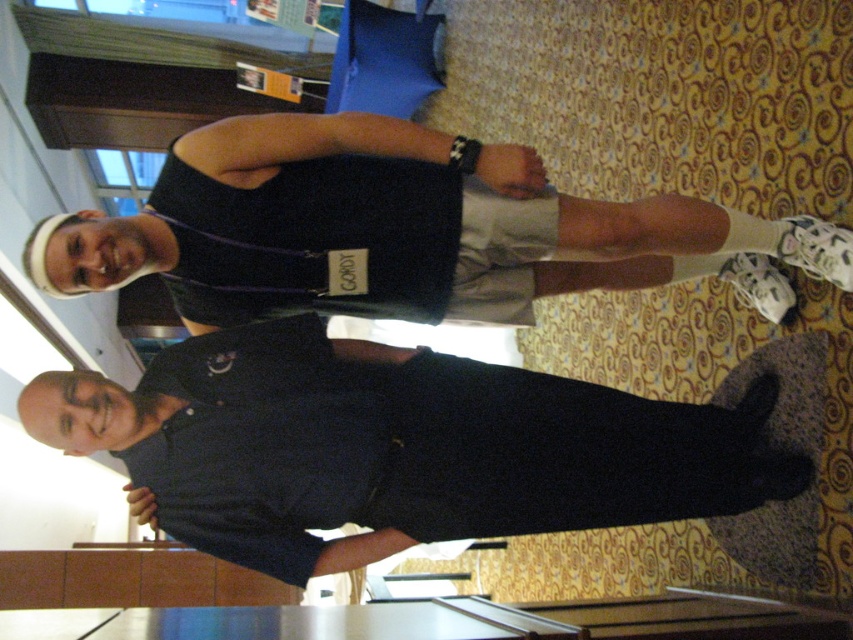
Who is higher up, black smooth shirt at center or black fabric tank top at upper center?

black fabric tank top at upper center

Looking at this image, is black smooth shirt at center wider than black fabric tank top at upper center?

No.

Is point (378, 444) positioned behind point (273, 227)?

No, (378, 444) is in front of (273, 227).

The image size is (853, 640). What are the coordinates of `black smooth shirt at center` in the screenshot? It's located at (396, 448).